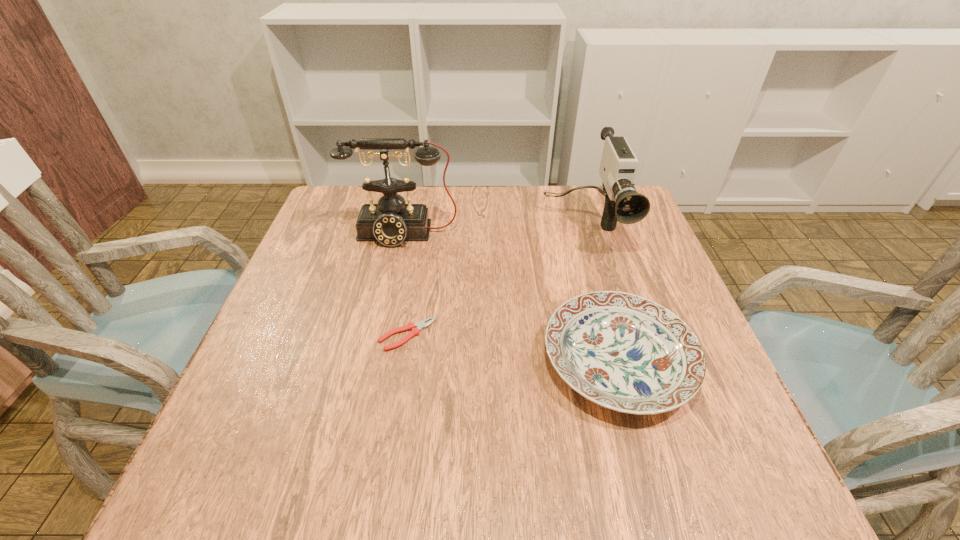
Where is `telephone`? The height and width of the screenshot is (540, 960). telephone is located at coordinates (391, 222).

Locate an element on the screen. The width and height of the screenshot is (960, 540). the second tallest object is located at coordinates (623, 203).

The image size is (960, 540). In order to click on plate in this screenshot , I will do `click(624, 352)`.

The image size is (960, 540). What are the coordinates of `the shortest object` in the screenshot? It's located at (415, 328).

Find the location of a particular element. vacant area situated on the dial of the tallest object is located at coordinates (374, 363).

At what (x,y) coordinates should I click in order to perform the action: click on vacant area located on the recording direction of the second tallest object. Please return your answer as a coordinate pair (x, y). Image resolution: width=960 pixels, height=540 pixels. Looking at the image, I should click on (624, 365).

Where is `vacant space located 0.280m on the left of the plate`? vacant space located 0.280m on the left of the plate is located at coordinates (396, 361).

The height and width of the screenshot is (540, 960). In order to click on blank area located 0.390m on the back of the pliers in this screenshot , I will do `click(426, 214)`.

Locate an element on the screen. This screenshot has height=540, width=960. telephone that is at the far edge is located at coordinates (391, 222).

In order to click on camcorder that is at the far edge in this screenshot , I will do `click(623, 203)`.